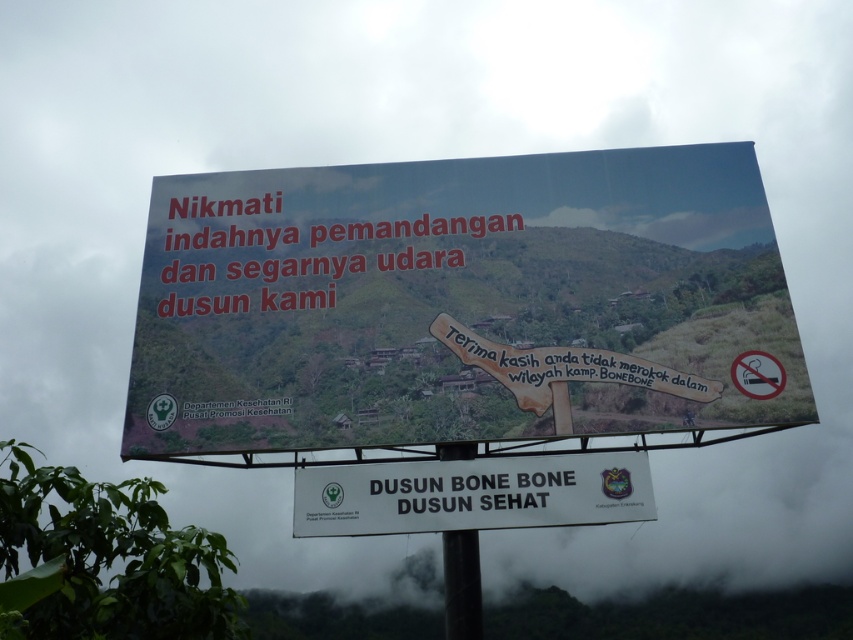
You are a hiker who just arrived at a scenic mountain area. You see the white plastic billboard at upper center and the white plastic signboard at center. Which one do you think is bigger in size?

The white plastic billboard at upper center is larger in size compared to the white plastic signboard at center.

You are a delivery person who needs to pass under the white plastic billboard at upper center and the black metal pole at center with a package that is 2 meters wide. Can your package fit through the space between them?

The white plastic billboard at upper center is wider than the black metal pole at center. Therefore, the package that is 2 meters wide may not fit through the space between them as the billboard is wider, potentially reducing the available width.